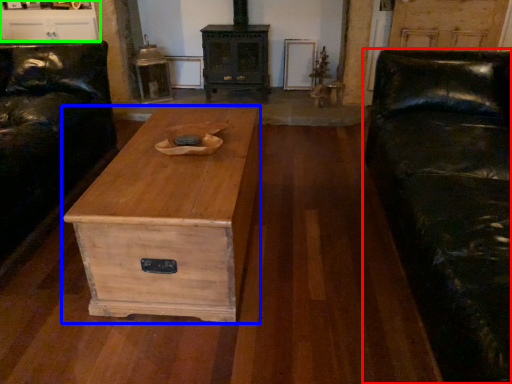
Question: Based on their relative distances, which object is nearer to studio couch (highlighted by a red box)? Choose from chest of drawers (highlighted by a blue box) and entertainment center (highlighted by a green box).

Choices:
 (A) chest of drawers
 (B) entertainment center

Answer: (A)